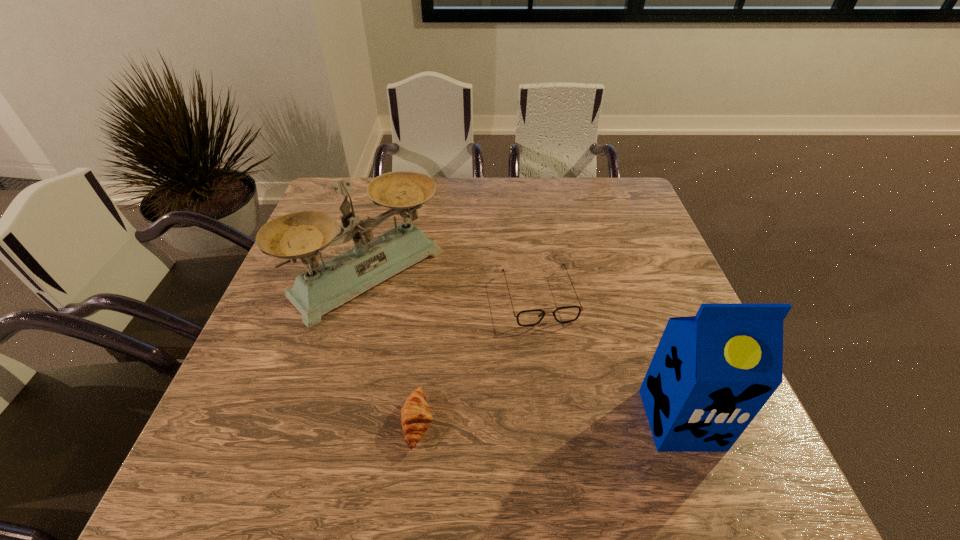
In order to click on free point between the shortest object and the scale in this screenshot , I will do `click(394, 348)`.

This screenshot has width=960, height=540. I want to click on vacant area that lies between the sunglasses and the third shortest object, so click(x=454, y=286).

Point out which object is positioned as the third nearest to the shortest object. Please provide its 2D coordinates. Your answer should be formatted as a tuple, i.e. [(x, y)], where the tuple contains the x and y coordinates of a point satisfying the conditions above.

[(711, 374)]

Identify which object is the nearest to the rightmost object. Please provide its 2D coordinates. Your answer should be formatted as a tuple, i.e. [(x, y)], where the tuple contains the x and y coordinates of a point satisfying the conditions above.

[(566, 314)]

At what (x,y) coordinates should I click in order to perform the action: click on vacant point that satisfies the following two spatial constraints: 1. on the front side of the pastry; 2. on the front-facing side of the third shortest object. Please return your answer as a coordinate pair (x, y). The image size is (960, 540). Looking at the image, I should click on (328, 422).